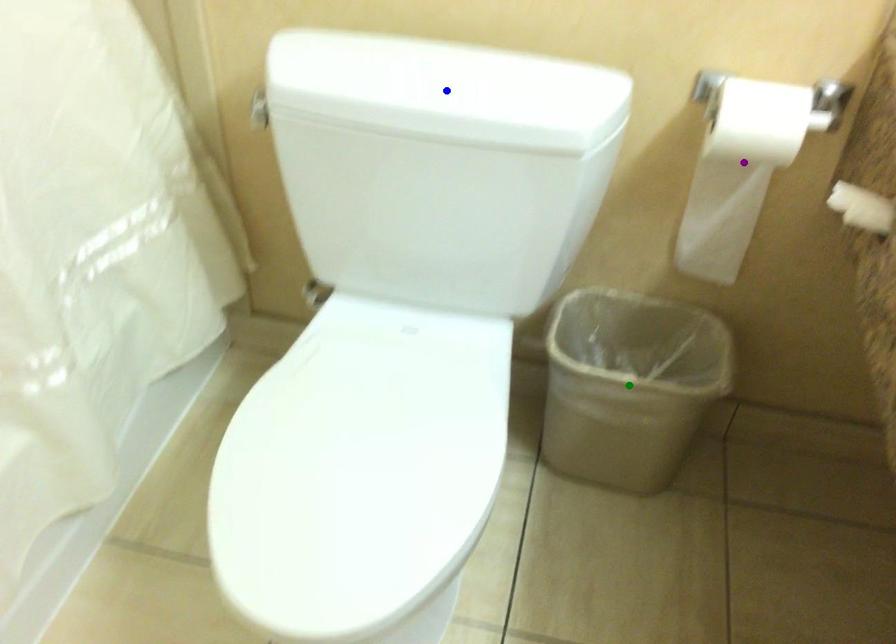
Order these from farthest to nearest:
- blue point
- purple point
- green point

green point → purple point → blue point